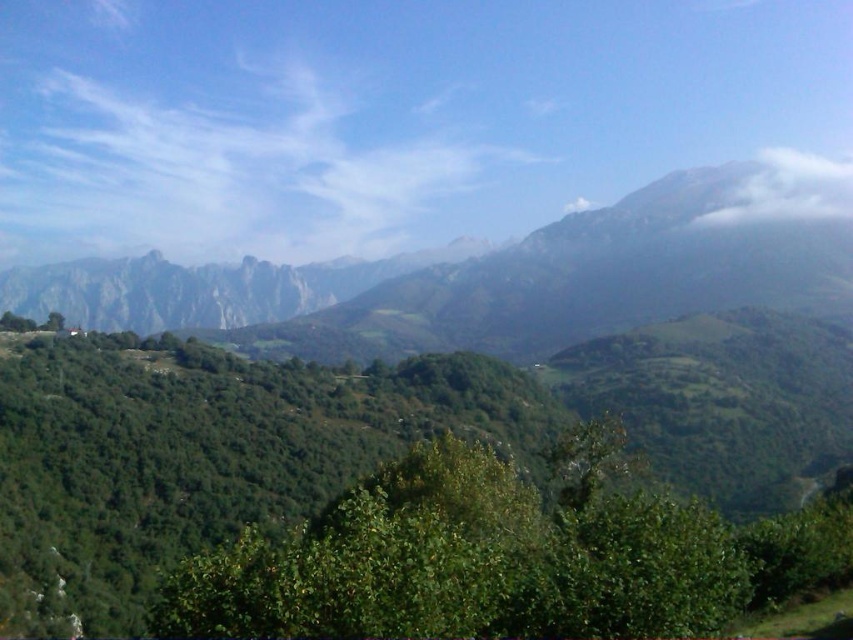
You are a hiker planning to reach the point marked at coordinates (500, 304) in the mountainous landscape. Given that your average walking speed is 3 km per hour, how long would it take you to reach the point from your current position?

The point marked at coordinates (500, 304) is 453.64 meters away from the camera. At an average walking speed of 3 km per hour, it would take approximately 9 minutes to reach the point.

You are an airplane passenger looking out the window and see the green grassy mountain range at upper center and the white fluffy cloud at upper right. Which object is closer to the left side of your view?

The green grassy mountain range at upper center is closer to the left side of your view because it is positioned to the left of the white fluffy cloud at upper right.

You are a pilot flying a small airplane and you need to navigate between the green grassy mountain range at upper center and the white fluffy cloud at upper right. Which one is higher in the sky?

The green grassy mountain range at upper center is taller than the white fluffy cloud at upper right, so the mountain range is higher in the sky than the cloud.